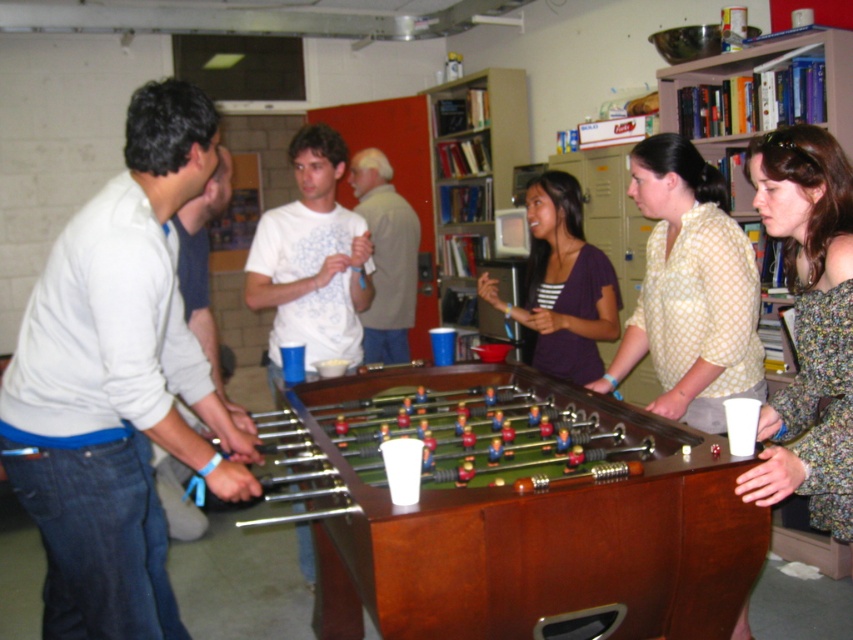
You are standing in front of the brown wooden foosball table at center and want to reach a snack that is placed on the table. If your arm can extend 2.5 feet, can you comfortably reach the snack without moving closer?

The brown wooden foosball table at center is 4.89 feet away from you. Since your arm can only extend 2.5 feet, you cannot comfortably reach the snack without moving closer.

You are organizing a small event and need to place a 1.5 meter long banner on the table. Considering the brown wooden foosball table at center and the light brown shirt at center, which object can accommodate the banner without overlapping?

The brown wooden foosball table at center is larger in size than the light brown shirt at center, so the banner can be placed on the brown wooden foosball table at center without overlapping.